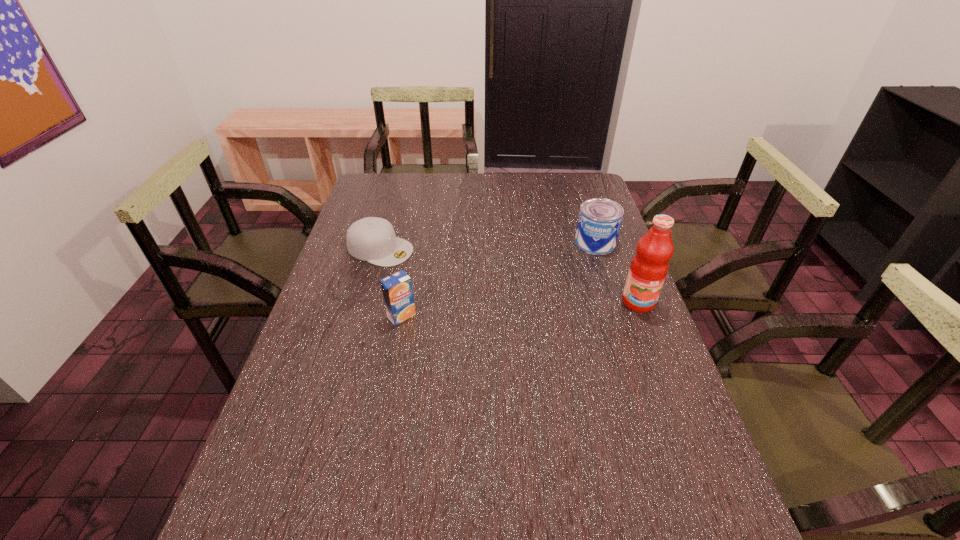
This screenshot has width=960, height=540. In order to click on vacant position located on the front label of the can in this screenshot , I will do click(x=562, y=281).

I want to click on vacant space situated 0.120m on the front label of the can, so click(569, 272).

Identify the location of object present at the left edge. (372, 239).

What are the coordinates of `fruit juice present at the right edge` in the screenshot? It's located at (649, 266).

This screenshot has width=960, height=540. What are the coordinates of `can that is at the right edge` in the screenshot? It's located at (599, 222).

At what (x,y) coordinates should I click in order to perform the action: click on free region at the far edge of the desktop. Please return your answer as a coordinate pair (x, y). Looking at the image, I should click on 546,178.

You are a GUI agent. You are given a task and a screenshot of the screen. Output one action in this format:
    pyautogui.click(x=<x>, y=<y>)
    Task: Click on the vacant space at the left edge of the desktop
    Image resolution: width=960 pixels, height=540 pixels.
    Given the screenshot: What is the action you would take?
    pyautogui.click(x=344, y=323)

You are a GUI agent. You are given a task and a screenshot of the screen. Output one action in this format:
    pyautogui.click(x=<x>, y=<y>)
    Task: Click on the vacant area at the right edge
    The width and height of the screenshot is (960, 540).
    Given the screenshot: What is the action you would take?
    pyautogui.click(x=602, y=299)

Locate an element on the screen. vacant space at the near right corner of the desktop is located at coordinates (645, 488).

Find the location of a particular element. Image resolution: width=960 pixels, height=540 pixels. unoccupied area between the orange_juice and the can is located at coordinates tap(498, 279).